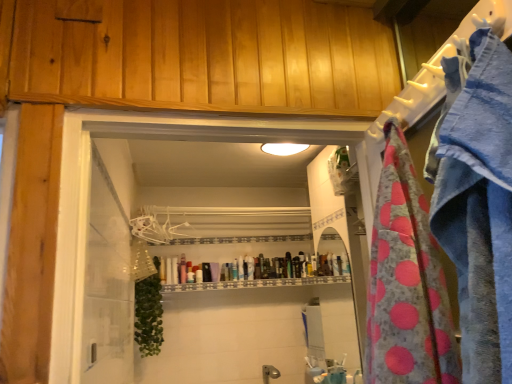
Image resolution: width=512 pixels, height=384 pixels. What do you see at coordinates (406, 282) in the screenshot? I see `pink polka dot fabric at right` at bounding box center [406, 282].

Where is `pink polka dot fabric at right`? The height and width of the screenshot is (384, 512). pink polka dot fabric at right is located at coordinates (406, 282).

Is white plastic hanger at upper center beside pink polka dot fabric at right?

white plastic hanger at upper center is not next to pink polka dot fabric at right, and they're not touching.

Can you confirm if white plastic hanger at upper center is thinner than pink polka dot fabric at right?

Yes.

Which of these two, white plastic hanger at upper center or pink polka dot fabric at right, is smaller?

white plastic hanger at upper center is smaller.

Is white plastic hanger at upper center inside or outside of pink polka dot fabric at right?

white plastic hanger at upper center is not inside pink polka dot fabric at right, it's outside.

In terms of width, does pink polka dot fabric at right look wider or thinner when compared to translucent plastic tube at center?

In the image, pink polka dot fabric at right appears to be wider than translucent plastic tube at center.

Measure the distance between pink polka dot fabric at right and translucent plastic tube at center.

pink polka dot fabric at right and translucent plastic tube at center are 2.57 meters apart.

Which is behind, point (415, 264) or point (199, 282)?

The point (199, 282) is farther.

Which is in front, point (187, 231) or point (202, 278)?

The point (202, 278) is in front.

Find the location of `hanger located above the translucent plastic tube at center (from a real-world perspective)`. hanger located above the translucent plastic tube at center (from a real-world perspective) is located at coordinates (180, 230).

In the scene shown: Which of these two, white plastic hanger at upper center or translucent plastic tube at center, is wider?

translucent plastic tube at center is wider.

Is translucent plastic tube at center inside the boundaries of pink polka dot fabric at right, or outside?

translucent plastic tube at center is spatially situated outside pink polka dot fabric at right.

Looking at the image, does translucent plastic tube at center seem bigger or smaller compared to pink polka dot fabric at right?

In the image, translucent plastic tube at center appears to be smaller than pink polka dot fabric at right.

Can you confirm if translucent plastic tube at center is thinner than pink polka dot fabric at right?

Correct, the width of translucent plastic tube at center is less than that of pink polka dot fabric at right.

From a real-world perspective, which object rests below the other?

pink polka dot fabric at right is physically lower.

Which is in front, point (376, 349) or point (180, 236)?

Point (376, 349)

Does pink polka dot fabric at right turn towards white plastic hanger at upper center?

No, pink polka dot fabric at right is not turned towards white plastic hanger at upper center.

From the image's perspective, which is below, pink polka dot fabric at right or white plastic hanger at upper center?

From the image's view, white plastic hanger at upper center is below.

Based on their positions, is pink polka dot fabric at right located to the left or right of white plastic hanger at upper center?

pink polka dot fabric at right is positioned on white plastic hanger at upper center's right side.

Are translucent plastic tube at center and white plastic hanger at upper center far apart?

No, translucent plastic tube at center is not far away from white plastic hanger at upper center.

Is translucent plastic tube at center looking in the opposite direction of white plastic hanger at upper center?

No, translucent plastic tube at center is not facing away from white plastic hanger at upper center.

From the picture: Does translucent plastic tube at center have a greater height compared to white plastic hanger at upper center?

No, translucent plastic tube at center is not taller than white plastic hanger at upper center.

Which is in front, translucent plastic tube at center or white plastic hanger at upper center?

white plastic hanger at upper center is in front.

The image size is (512, 384). In order to click on hanger behind the pink polka dot fabric at right in this screenshot , I will do `click(180, 230)`.

Locate an element on the screen. Image resolution: width=512 pixels, height=384 pixels. beach towel on the right of translucent plastic tube at center is located at coordinates tap(406, 282).

When comparing their distances from translucent plastic tube at center, does pink polka dot fabric at right or white plastic hanger at upper center seem further?

The object further to translucent plastic tube at center is pink polka dot fabric at right.

From the image, which object appears to be nearer to pink polka dot fabric at right, translucent plastic tube at center or white plastic hanger at upper center?

translucent plastic tube at center is closer to pink polka dot fabric at right.

Estimate the real-world distances between objects in this image. Which object is closer to translucent plastic tube at center, white plastic hanger at upper center or pink polka dot fabric at right?

white plastic hanger at upper center.

Which object lies nearer to the anchor point pink polka dot fabric at right, white plastic hanger at upper center or translucent plastic tube at center?

Among the two, translucent plastic tube at center is located nearer to pink polka dot fabric at right.

Which object lies further to the anchor point white plastic hanger at upper center, translucent plastic tube at center or pink polka dot fabric at right?

Among the two, pink polka dot fabric at right is located further to white plastic hanger at upper center.

Considering their positions, is pink polka dot fabric at right positioned further to white plastic hanger at upper center than translucent plastic tube at center?

pink polka dot fabric at right.

Locate an element on the screen. Image resolution: width=512 pixels, height=384 pixels. hanger between pink polka dot fabric at right and translucent plastic tube at center from front to back is located at coordinates (180, 230).